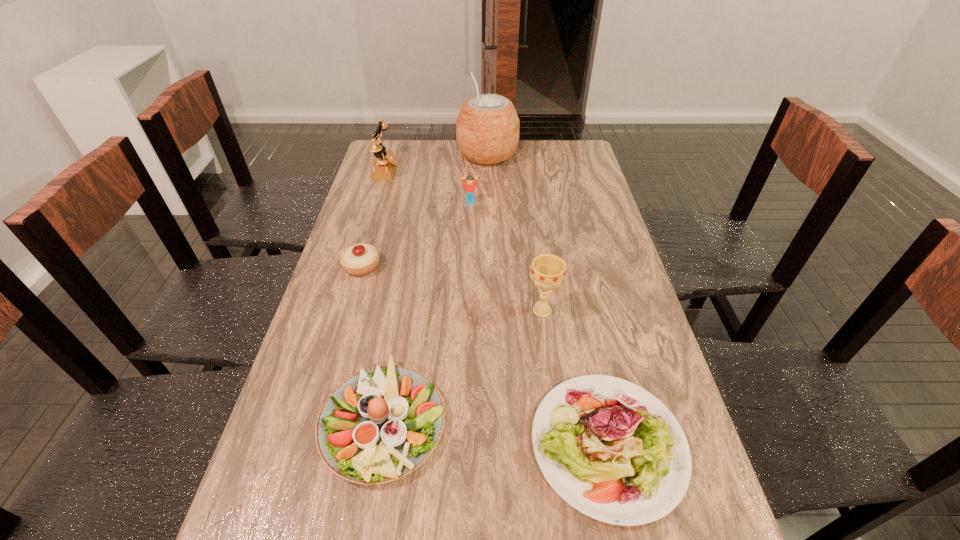
You are a GUI agent. You are given a task and a screenshot of the screen. Output one action in this format:
    pyautogui.click(x=<x>, y=<y>)
    Task: Click on the coconut
    This screenshot has height=540, width=960.
    Given the screenshot: What is the action you would take?
    pyautogui.click(x=487, y=129)

The height and width of the screenshot is (540, 960). I want to click on telephone, so click(x=384, y=166).

Where is `chalice`? Image resolution: width=960 pixels, height=540 pixels. chalice is located at coordinates (547, 271).

In order to click on the third farthest object in this screenshot , I will do `click(469, 184)`.

This screenshot has width=960, height=540. I want to click on Lego, so click(469, 184).

The height and width of the screenshot is (540, 960). I want to click on the taller salad plate, so click(x=380, y=424).

The height and width of the screenshot is (540, 960). I want to click on pastry, so click(x=360, y=259).

Where is `the shorter salad plate`? The image size is (960, 540). the shorter salad plate is located at coordinates (613, 451).

Where is `the right salad plate`? the right salad plate is located at coordinates (613, 451).

Where is `free space located 0.170m on the right of the coconut`? The width and height of the screenshot is (960, 540). free space located 0.170m on the right of the coconut is located at coordinates (561, 155).